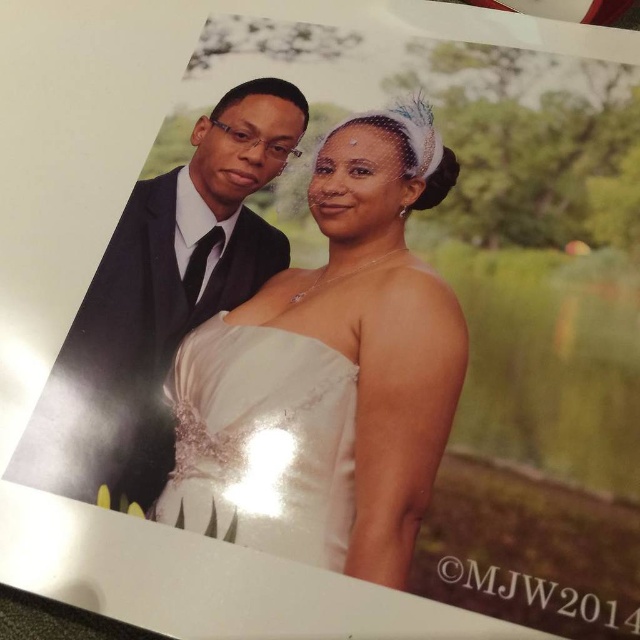
You are a photographer trying to capture a candid shot of the couple. Since the white satin dress at center and the matte black suit at left are positioned in a way that might block each other, which one should you focus on to ensure the subject is fully visible?

The white satin dress at center is in front of the matte black suit at left, so focusing on the white satin dress at center will ensure it remains fully visible without obstruction.

From the picture: You are a photographer adjusting your camera settings to capture the wedding couple. The camera lens has a focal length of 50mm and an aperture of f2.8. To ensure the point at point (198, 339) is in focus, what adjustment should you make to the camera?

The point at point (198, 339) is 19.59 inches from the viewer. To ensure it is in focus, adjust the camera focus to 19.59 inches.

Based on the scene description, which object is taller between the white satin dress at center and the matte black suit at left?

The white satin dress at center is taller than the matte black suit at left.